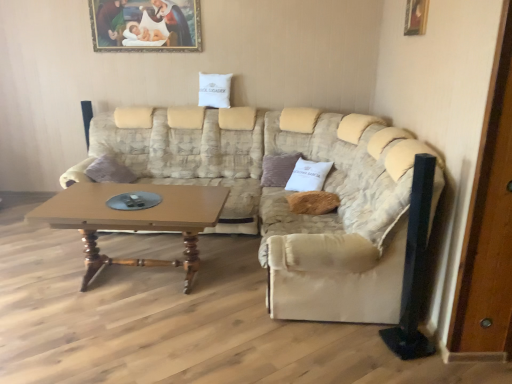
Question: Is brown fabric pillow at center, the 2th pillow positioned from the right, to the left or to the right of white cotton pillow at upper center, the first pillow in the left-to-right sequence, in the image?

Choices:
 (A) left
 (B) right

Answer: (B)

Question: Do you think brown fabric pillow at center, which ranks as the 2th pillow in left-to-right order, is within white cotton pillow at upper center, the 3th pillow from the bottom, or outside of it?

Choices:
 (A) outside
 (B) inside

Answer: (A)

Question: Which object is the farthest from the wooden door at right?

Choices:
 (A) wooden picture frame at upper right, which is the second picture frame from back to front
 (B) brown fabric pillow at center, the second pillow in the front-to-back sequence
 (C) wooden polished coffee table at center
 (D) beige fabric couch at center
 (E) fuzzy beige pillow at center, the third pillow when ordered from top to bottom

Answer: (B)

Question: Estimate the real-world distances between objects in this image. Which object is farther from the wooden framed painting at upper center, placed as the first picture frame when sorted from top to bottom?

Choices:
 (A) beige fabric couch at right
 (B) wooden door at right
 (C) brown fabric pillow at center, which is counted as the second pillow, starting from the bottom
 (D) beige fabric couch at center
 (E) white cotton pillow at upper center, positioned as the third pillow in right-to-left order

Answer: (B)